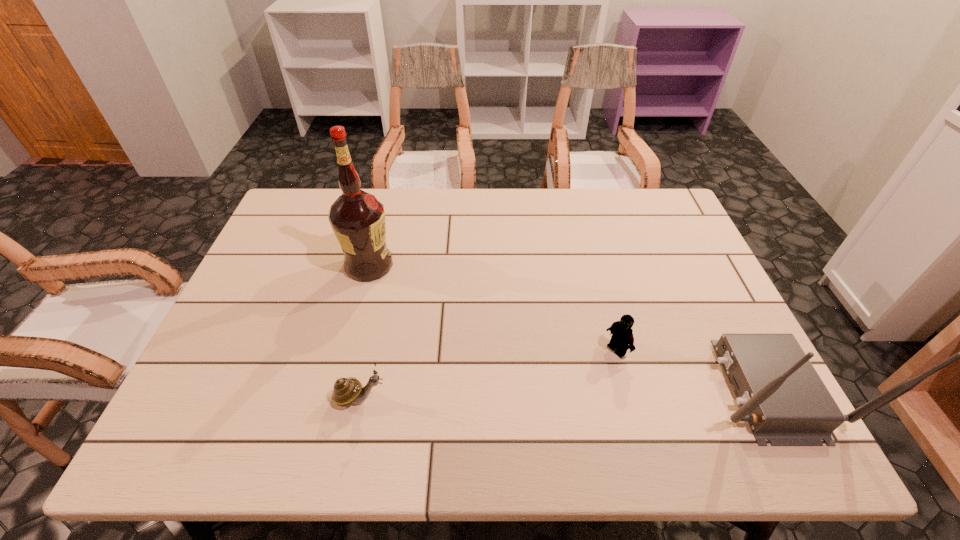
The width and height of the screenshot is (960, 540). I want to click on vacant region located 0.190m on the face of the second object from right to left, so click(x=546, y=396).

Where is `vacant region located on the face of the second object from right to left`? The image size is (960, 540). vacant region located on the face of the second object from right to left is located at coordinates (x=553, y=391).

Locate an element on the screen. free spot located on the face of the second object from right to left is located at coordinates (532, 404).

At what (x,y) coordinates should I click in order to perform the action: click on free region located on the label of the alcohol. Please return your answer as a coordinate pair (x, y). The width and height of the screenshot is (960, 540). Looking at the image, I should click on (487, 343).

The height and width of the screenshot is (540, 960). What are the coordinates of `free space located on the label of the alcohol` in the screenshot? It's located at (474, 334).

At what (x,y) coordinates should I click in order to perform the action: click on free space located on the label of the alcohol. Please return your answer as a coordinate pair (x, y). This screenshot has height=540, width=960. Looking at the image, I should click on (477, 336).

The height and width of the screenshot is (540, 960). I want to click on snail present at the near edge, so [x=349, y=390].

This screenshot has width=960, height=540. Find the location of `router that is positioned at the near edge`. router that is positioned at the near edge is located at coordinates [x=784, y=400].

This screenshot has width=960, height=540. I want to click on object that is at the right edge, so click(784, 400).

Locate an element on the screen. The height and width of the screenshot is (540, 960). object located at the near right corner is located at coordinates (784, 400).